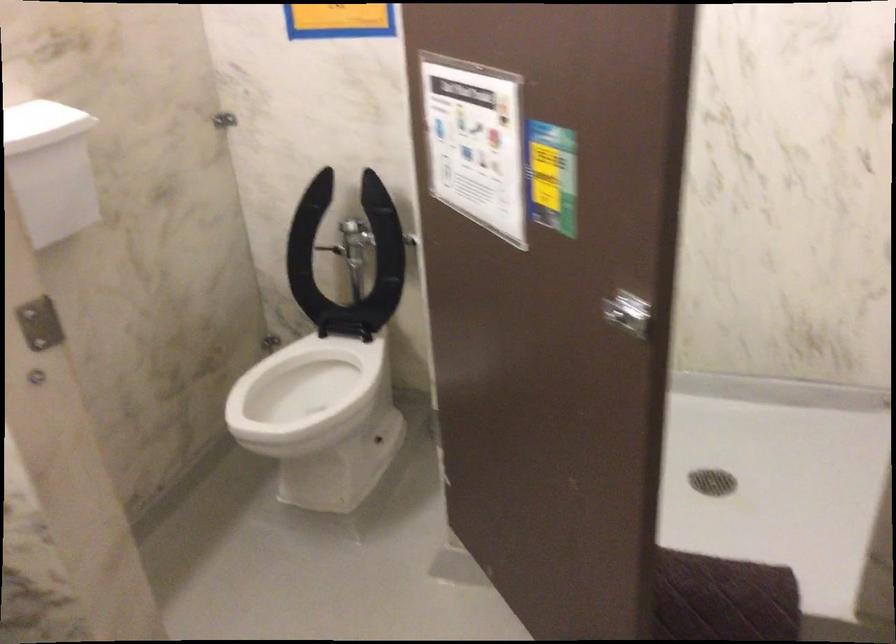
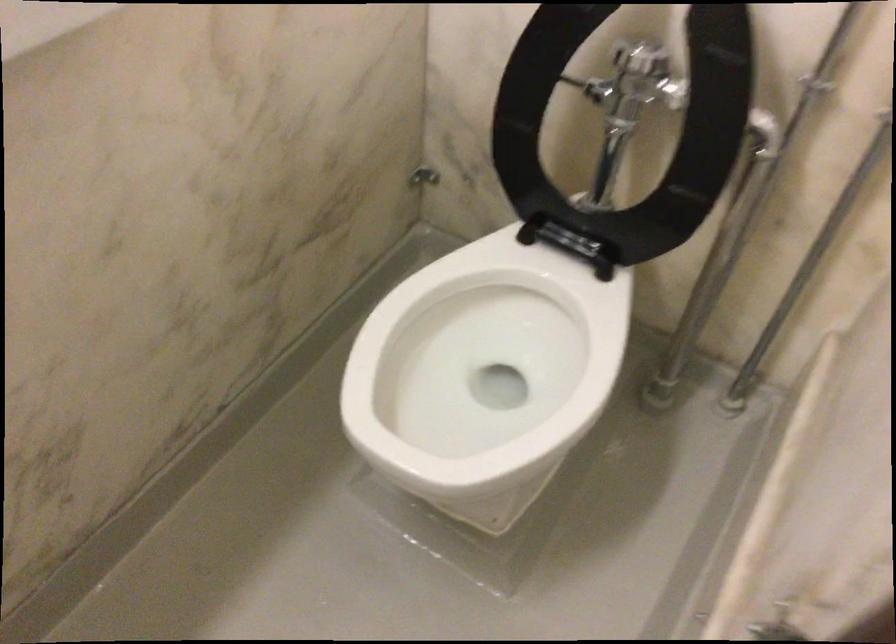
Locate, in the second image, the point that corresponds to [358,236] in the first image.

(633, 82)